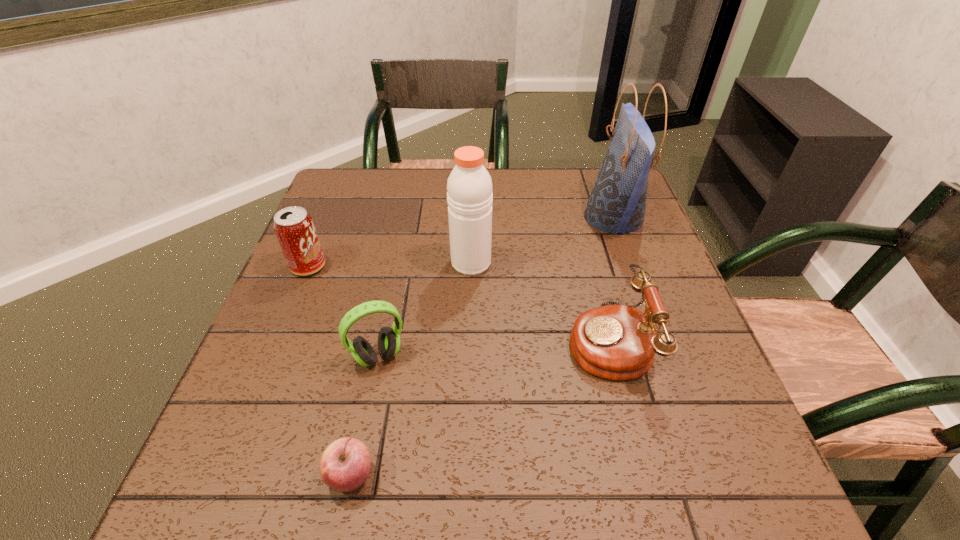
Identify the location of blank region between the fourth object from left to right and the farthest object. (542, 240).

Identify the location of vacant space that's between the headset and the nearest object. The image size is (960, 540). (365, 416).

Image resolution: width=960 pixels, height=540 pixels. Find the location of `vacant point located between the tallest object and the telephone`. vacant point located between the tallest object and the telephone is located at coordinates (611, 279).

Where is `vacant area between the headset and the telephone`? vacant area between the headset and the telephone is located at coordinates (493, 348).

Find the location of `free point between the farthest object and the nearest object`. free point between the farthest object and the nearest object is located at coordinates (482, 347).

Locate an element on the screen. The width and height of the screenshot is (960, 540). free point between the farthest object and the nearest object is located at coordinates (482, 347).

Where is `vacant space in between the shortest object and the headset`? vacant space in between the shortest object and the headset is located at coordinates (365, 416).

This screenshot has width=960, height=540. Find the location of `vacant space in between the soda can and the shaker`. vacant space in between the soda can and the shaker is located at coordinates (390, 265).

This screenshot has width=960, height=540. I want to click on object that is the closest to the telephone, so click(x=469, y=197).

Select which object appears as the fifth closest to the second tallest object. Please provide its 2D coordinates. Your answer should be formatted as a tuple, i.e. [(x, y)], where the tuple contains the x and y coordinates of a point satisfying the conditions above.

[(345, 465)]